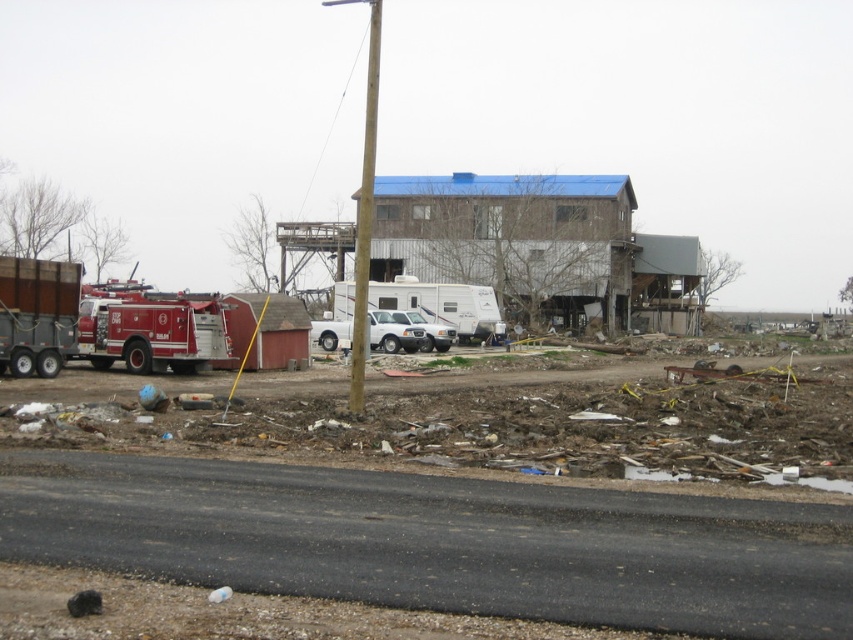
Question: Which point is closer to the camera?

Choices:
 (A) (340, 333)
 (B) (403, 278)
 (C) (219, 307)
 (D) (372, 134)

Answer: (C)

Question: From the image, what is the correct spatial relationship of shiny red fire truck at left in relation to white matte truck at center?

Choices:
 (A) below
 (B) above

Answer: (B)

Question: Based on their relative distances, which object is farther from the matte brown trailer truck at left?

Choices:
 (A) shiny red fire truck at left
 (B) white matte camper at center
 (C) brown wooden pole at center
 (D) white matte truck at center

Answer: (C)

Question: In this image, where is brown wooden pole at center located relative to white matte truck at center?

Choices:
 (A) below
 (B) above

Answer: (B)

Question: Does white matte camper at center have a smaller size compared to brown wooden pole at center?

Choices:
 (A) yes
 (B) no

Answer: (A)

Question: Among these points, which one is nearest to the camera?

Choices:
 (A) (374, 35)
 (B) (195, 340)
 (C) (408, 323)
 (D) (422, 300)

Answer: (B)